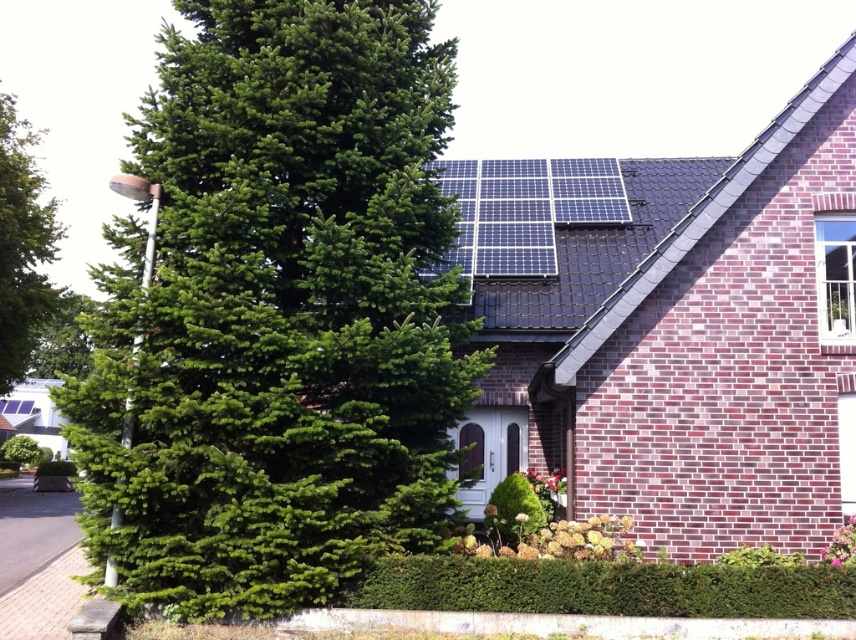
Does green matte tree at center appear over green leafy tree at left?

No, green matte tree at center is not above green leafy tree at left.

Is point (432, 317) positioned in front of point (4, 243)?

Yes, it is.

Locate an element on the screen. This screenshot has height=640, width=856. green matte tree at center is located at coordinates (281, 314).